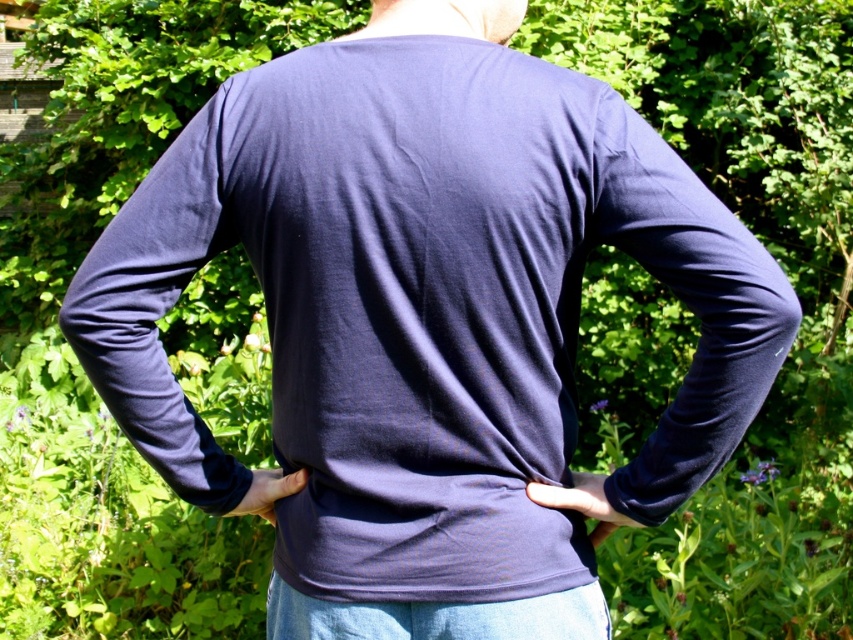
Based on the photo, you are a fashion designer observing a model in a garden. You notice the matte black hand at center and the matte blue fabric at center. Which object is located to the right of the other?

The matte black hand at center is positioned on the right side of the matte blue fabric at center.

You are a photographer trying to capture the exact position of the matte black hand at center in the image. According to the coordinates provided, where would you focus your camera lens to ensure the hand is in the center of your shot?

According to the coordinates provided, the matte black hand at center is located at point 0.786 on the x axis and 0.683 on the y axis. To center the hand in your shot, focus your camera lens at those coordinates.

You are a tailor measuring a piece of fabric and a hand in an image. The navy blue fabric at center and the matte black hand at center are both in your view. Which object occupies more space in the image?

The navy blue fabric at center has a larger size compared to the matte black hand at center, so the navy blue fabric at center occupies more space in the image.